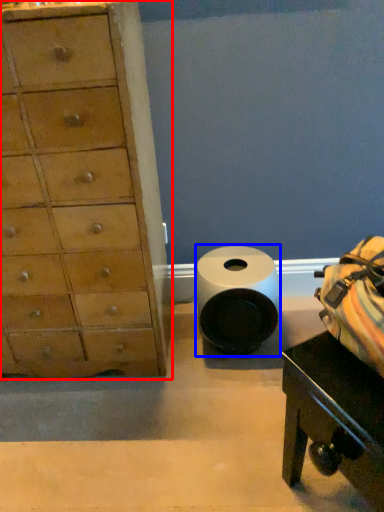
Question: Which of the following is the farthest to the observer, chest of drawers (highlighted by a red box) or toilet paper (highlighted by a blue box)?

Choices:
 (A) chest of drawers
 (B) toilet paper

Answer: (B)